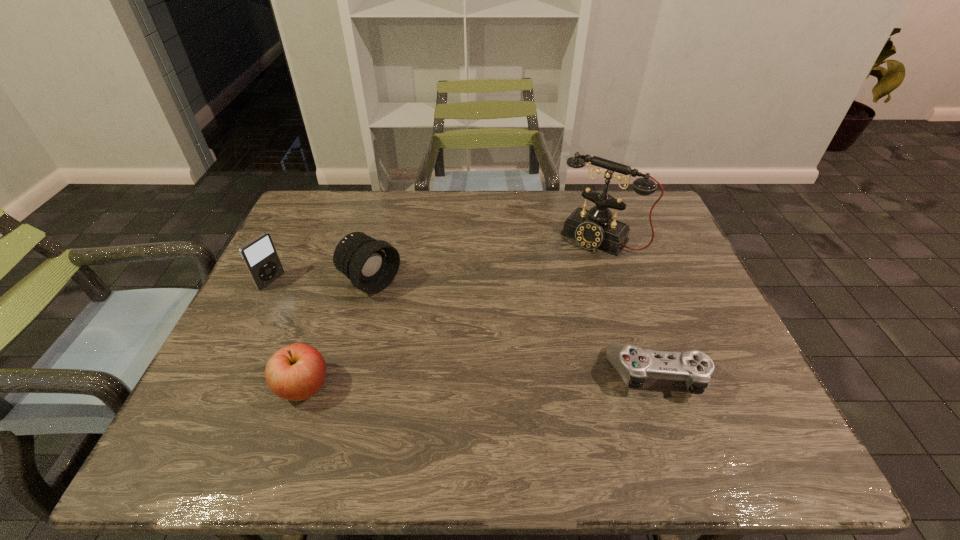
Find the location of a particular element. The height and width of the screenshot is (540, 960). apple situated at the left edge is located at coordinates (296, 372).

This screenshot has width=960, height=540. What are the coordinates of `iPod present at the left edge` in the screenshot? It's located at (259, 255).

Locate an element on the screen. The height and width of the screenshot is (540, 960). control that is at the right edge is located at coordinates (634, 364).

The width and height of the screenshot is (960, 540). In order to click on telephone at the right edge in this screenshot , I will do `click(593, 229)`.

At what (x,y) coordinates should I click in order to perform the action: click on object positioned at the near left corner. Please return your answer as a coordinate pair (x, y). The image size is (960, 540). Looking at the image, I should click on (296, 372).

The height and width of the screenshot is (540, 960). I want to click on object positioned at the far right corner, so click(x=593, y=229).

At what (x,y) coordinates should I click in order to perform the action: click on object located at the near right corner. Please return your answer as a coordinate pair (x, y). Image resolution: width=960 pixels, height=540 pixels. Looking at the image, I should click on (634, 364).

Find the location of a particular element. The width and height of the screenshot is (960, 540). vacant space at the far edge of the desktop is located at coordinates (414, 225).

In the image, there is a desktop. In order to click on free space at the near edge in this screenshot , I will do `click(414, 400)`.

Identify the location of vacant position at the left edge of the desktop. The image size is (960, 540). (286, 240).